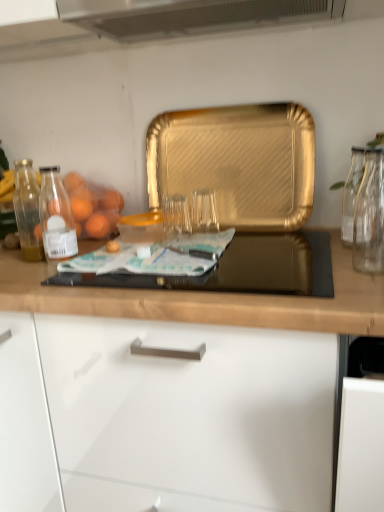
The image size is (384, 512). I want to click on free space to the right of transparent glass at center, the 1th glass jar from the left, so click(250, 241).